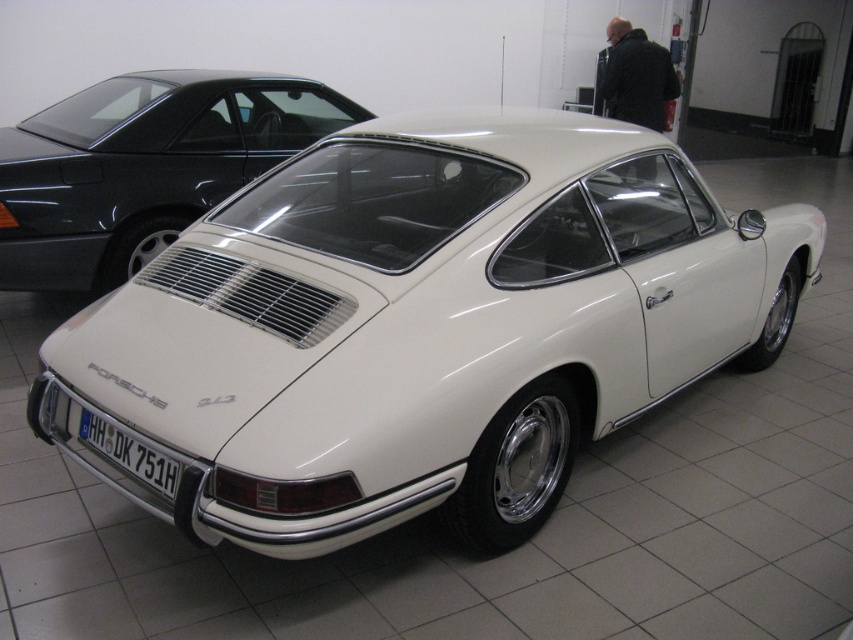
Question: Can you confirm if white glossy porsche at center is positioned to the left of white plastic license plate at center?

Choices:
 (A) yes
 (B) no

Answer: (A)

Question: Based on their relative distances, which object is nearer to the white glossy porsche at center?

Choices:
 (A) white glossy car at center
 (B) white plastic license plate at center

Answer: (A)

Question: Is white glossy car at center positioned at the back of white plastic license plate at center?

Choices:
 (A) yes
 (B) no

Answer: (B)

Question: Among these objects, which one is nearest to the camera?

Choices:
 (A) white glossy porsche at center
 (B) white plastic license plate at center

Answer: (B)

Question: Which object is the farthest from the white glossy porsche at center?

Choices:
 (A) white glossy car at center
 (B) white plastic license plate at center

Answer: (B)

Question: Is white glossy porsche at center thinner than white plastic license plate at center?

Choices:
 (A) yes
 (B) no

Answer: (B)